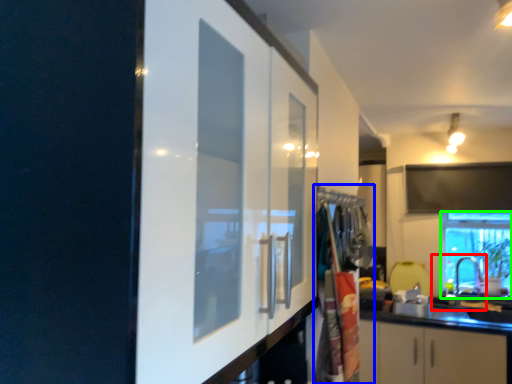
Question: Based on their relative distances, which object is nearer to sink (highlighted by a red box)? Choose from laundry (highlighted by a blue box) and window (highlighted by a green box).

Choices:
 (A) laundry
 (B) window

Answer: (B)